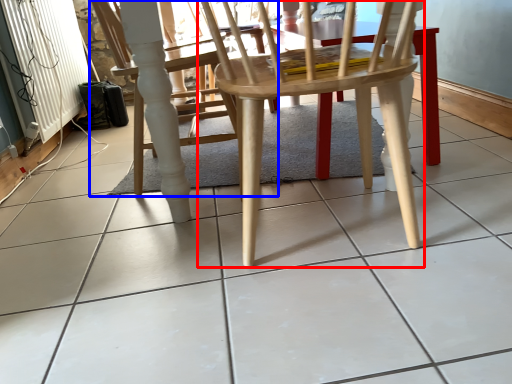
Question: Among these objects, which one is farthest to the camera, chair (highlighted by a red box) or chair (highlighted by a blue box)?

Choices:
 (A) chair
 (B) chair

Answer: (B)